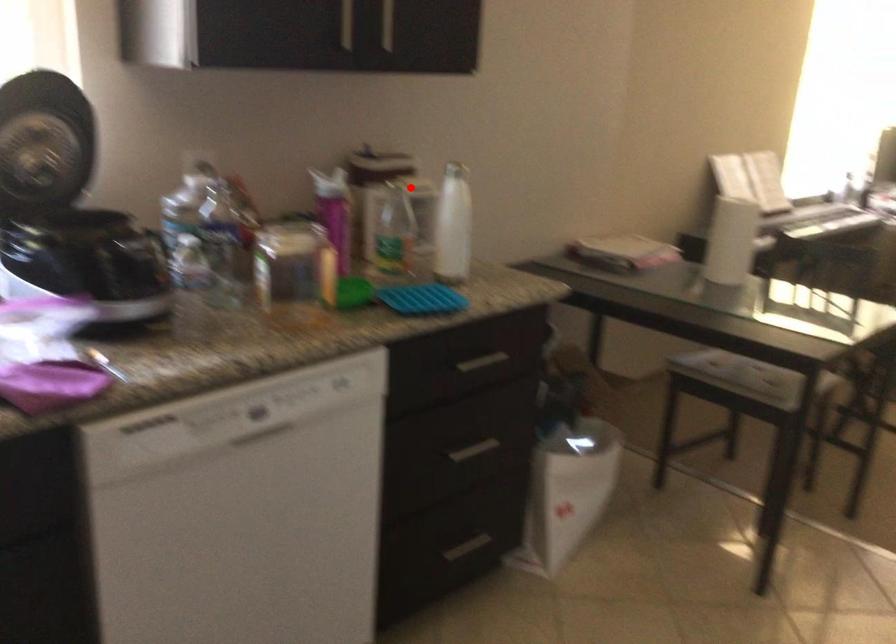
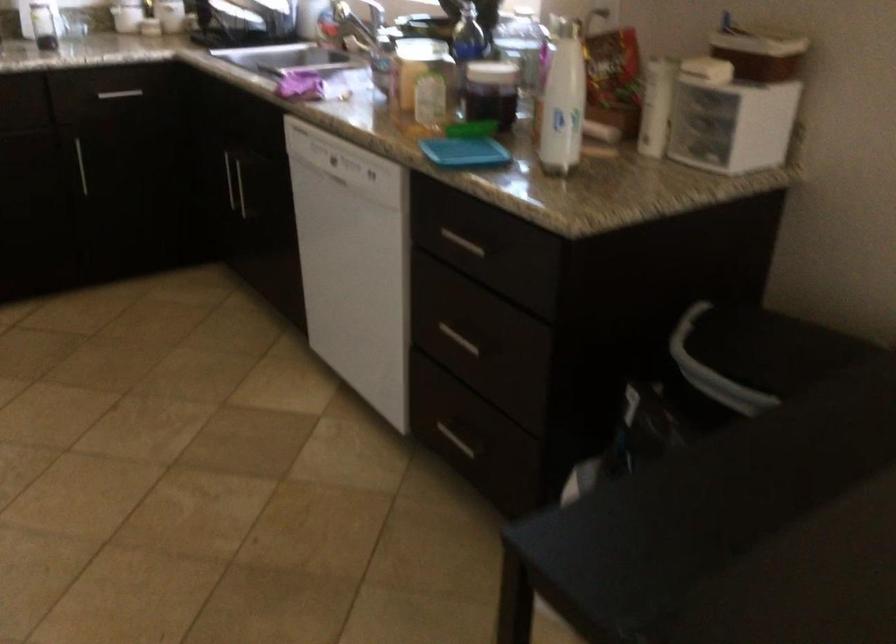
Question: A red point is marked in image1. In image2, is the corresponding 3D point closer to the camera or farther? Reply with the corresponding letter.

Choices:
 (A) The corresponding 3D point is closer.
 (B) The corresponding 3D point is farther.

Answer: (A)